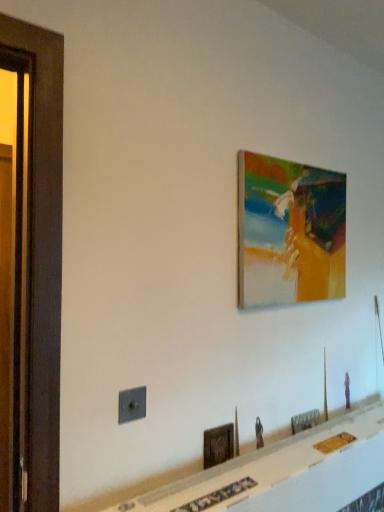
Question: Does wooden picture frame at lower center, which is the second picture frame in bottom-to-top order, come behind matte acrylic painting at upper right, which is the 1th picture frame in top-to-bottom order?

Choices:
 (A) yes
 (B) no

Answer: (B)

Question: Considering the relative sizes of wooden picture frame at lower center, placed as the second picture frame when sorted from top to bottom, and matte acrylic painting at upper right, positioned as the second picture frame in left-to-right order, in the image provided, is wooden picture frame at lower center, placed as the second picture frame when sorted from top to bottom, wider than matte acrylic painting at upper right, positioned as the second picture frame in left-to-right order,?

Choices:
 (A) no
 (B) yes

Answer: (A)

Question: Can you confirm if wooden picture frame at lower center, placed as the third picture frame when sorted from right to left, is positioned to the left of matte acrylic painting at upper right, which is the 1th picture frame in top-to-bottom order?

Choices:
 (A) no
 (B) yes

Answer: (B)

Question: Is wooden picture frame at lower center, which is the second picture frame in bottom-to-top order, to the right of matte acrylic painting at upper right, which is the 1th picture frame in top-to-bottom order, from the viewer's perspective?

Choices:
 (A) no
 (B) yes

Answer: (A)

Question: Is wooden picture frame at lower center, which is the second picture frame in bottom-to-top order, thinner than matte acrylic painting at upper right, which is the 1th picture frame in top-to-bottom order?

Choices:
 (A) no
 (B) yes

Answer: (B)

Question: From the image's perspective, is wooden picture frame at lower center, placed as the second picture frame when sorted from top to bottom, over matte acrylic painting at upper right, positioned as the second picture frame in left-to-right order?

Choices:
 (A) no
 (B) yes

Answer: (A)

Question: Is matte acrylic painting at upper right, which is the 3th picture frame in bottom-to-top order, bigger than wooden picture frame at lower center, which is the second picture frame in bottom-to-top order?

Choices:
 (A) no
 (B) yes

Answer: (B)

Question: Is matte acrylic painting at upper right, which is the 3th picture frame in bottom-to-top order, facing towards wooden picture frame at lower center, placed as the second picture frame when sorted from top to bottom?

Choices:
 (A) yes
 (B) no

Answer: (B)

Question: Would you consider matte acrylic painting at upper right, which is the 3th picture frame in bottom-to-top order, to be distant from wooden picture frame at lower center, placed as the second picture frame when sorted from top to bottom?

Choices:
 (A) yes
 (B) no

Answer: (B)

Question: From the image's perspective, is matte acrylic painting at upper right, which is the 1th picture frame in top-to-bottom order, located beneath wooden picture frame at lower center, the 1th picture frame from the left?

Choices:
 (A) no
 (B) yes

Answer: (A)

Question: Considering the relative sizes of matte acrylic painting at upper right, positioned as the second picture frame in left-to-right order, and wooden picture frame at lower center, the 1th picture frame from the left, in the image provided, is matte acrylic painting at upper right, positioned as the second picture frame in left-to-right order, thinner than wooden picture frame at lower center, the 1th picture frame from the left,?

Choices:
 (A) no
 (B) yes

Answer: (A)

Question: Can you confirm if matte acrylic painting at upper right, which is the 1th picture frame in top-to-bottom order, is positioned to the right of wooden picture frame at lower center, placed as the second picture frame when sorted from top to bottom?

Choices:
 (A) yes
 (B) no

Answer: (A)

Question: From the image's perspective, is wooden screen door at left beneath wooden picture frame at lower center, the first picture frame when ordered from bottom to top?

Choices:
 (A) no
 (B) yes

Answer: (A)